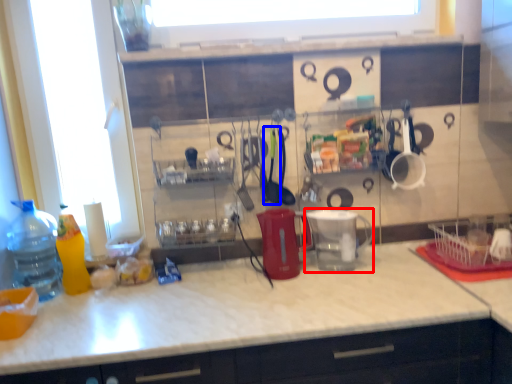
Question: Which object is closer to the camera taking this photo, appliance (highlighted by a red box) or tableware (highlighted by a blue box)?

Choices:
 (A) appliance
 (B) tableware

Answer: (A)